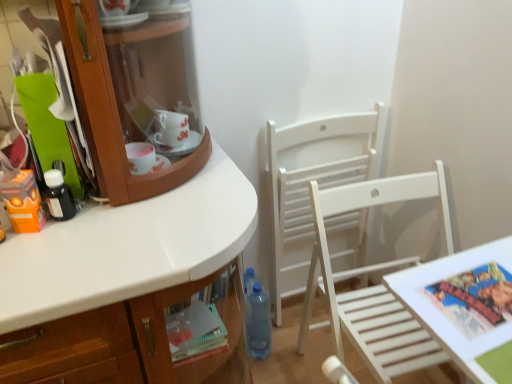
Question: Can you confirm if blue translucent bottle at lower center, which ranks as the first bottle in bottom-to-top order, is bigger than printed paper comic book at lower right?

Choices:
 (A) yes
 (B) no

Answer: (A)

Question: Considering the relative sizes of blue translucent bottle at lower center, which ranks as the first bottle in bottom-to-top order, and printed paper comic book at lower right in the image provided, is blue translucent bottle at lower center, which ranks as the first bottle in bottom-to-top order, taller than printed paper comic book at lower right?

Choices:
 (A) no
 (B) yes

Answer: (B)

Question: Would you consider blue translucent bottle at lower center, which appears as the second bottle when viewed from the left, to be distant from printed paper comic book at lower right?

Choices:
 (A) yes
 (B) no

Answer: (B)

Question: Can printed paper comic book at lower right be found inside blue translucent bottle at lower center, which ranks as the first bottle in bottom-to-top order?

Choices:
 (A) no
 (B) yes

Answer: (A)

Question: Could you tell me if blue translucent bottle at lower center, the first bottle from the right, is facing printed paper comic book at lower right?

Choices:
 (A) yes
 (B) no

Answer: (B)

Question: From a real-world perspective, is blue translucent bottle at lower center, the 2th bottle from the top, located higher than printed paper comic book at lower right?

Choices:
 (A) yes
 (B) no

Answer: (B)

Question: From a real-world perspective, is orange matte toy at left located beneath white wooden table at lower right?

Choices:
 (A) yes
 (B) no

Answer: (B)

Question: Does orange matte toy at left have a lesser height compared to white wooden table at lower right?

Choices:
 (A) yes
 (B) no

Answer: (A)

Question: Considering the relative sizes of orange matte toy at left and white wooden table at lower right in the image provided, is orange matte toy at left taller than white wooden table at lower right?

Choices:
 (A) no
 (B) yes

Answer: (A)

Question: Can you confirm if orange matte toy at left is positioned to the left of white wooden table at lower right?

Choices:
 (A) yes
 (B) no

Answer: (A)

Question: Can you confirm if orange matte toy at left is bigger than white wooden table at lower right?

Choices:
 (A) no
 (B) yes

Answer: (A)

Question: Is orange matte toy at left smaller than white wooden table at lower right?

Choices:
 (A) yes
 (B) no

Answer: (A)

Question: Is blue translucent bottle at lower center, which appears as the second bottle when viewed from the left, to the left of white wood chair at center, which is counted as the second chair, starting from the front, from the viewer's perspective?

Choices:
 (A) yes
 (B) no

Answer: (A)